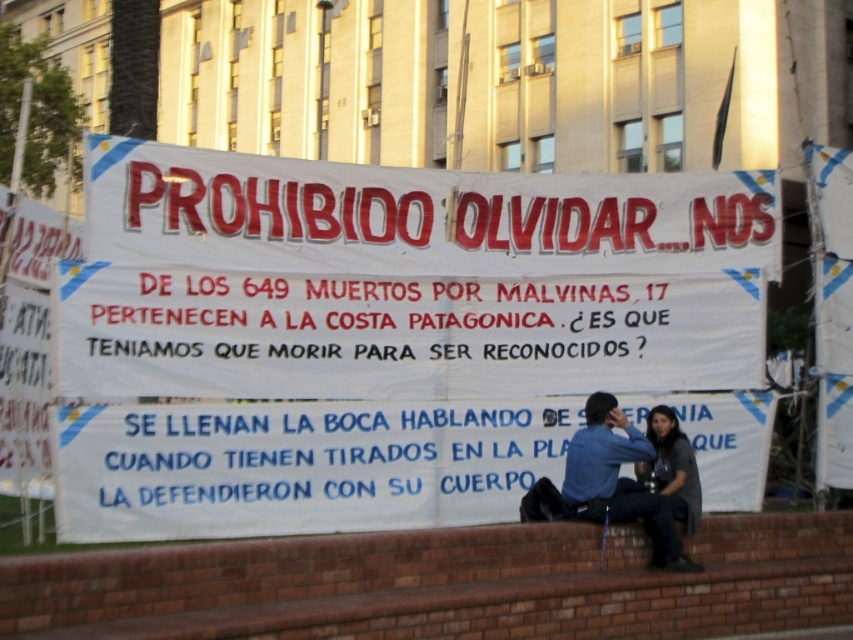
Question: Based on their relative distances, which object is nearer to the brick ledge at lower center?

Choices:
 (A) white paper banner at center
 (B) dark gray fabric shirt at lower right

Answer: (B)

Question: Is white paper banner at center to the left of brick ledge at lower center from the viewer's perspective?

Choices:
 (A) yes
 (B) no

Answer: (A)

Question: Estimate the real-world distances between objects in this image. Which object is closer to the dark gray fabric shirt at lower right?

Choices:
 (A) white paper banner at center
 (B) blue denim shirt at center
 (C) brick ledge at lower center

Answer: (B)

Question: Can you confirm if white paper banner at center is positioned below blue denim shirt at center?

Choices:
 (A) yes
 (B) no

Answer: (B)

Question: Which object is the closest to the white paper banner at center?

Choices:
 (A) blue denim shirt at center
 (B) dark gray fabric shirt at lower right
 (C) brick ledge at lower center

Answer: (A)

Question: From the image, what is the correct spatial relationship of white paper banner at center in relation to dark gray fabric shirt at lower right?

Choices:
 (A) right
 (B) left

Answer: (B)